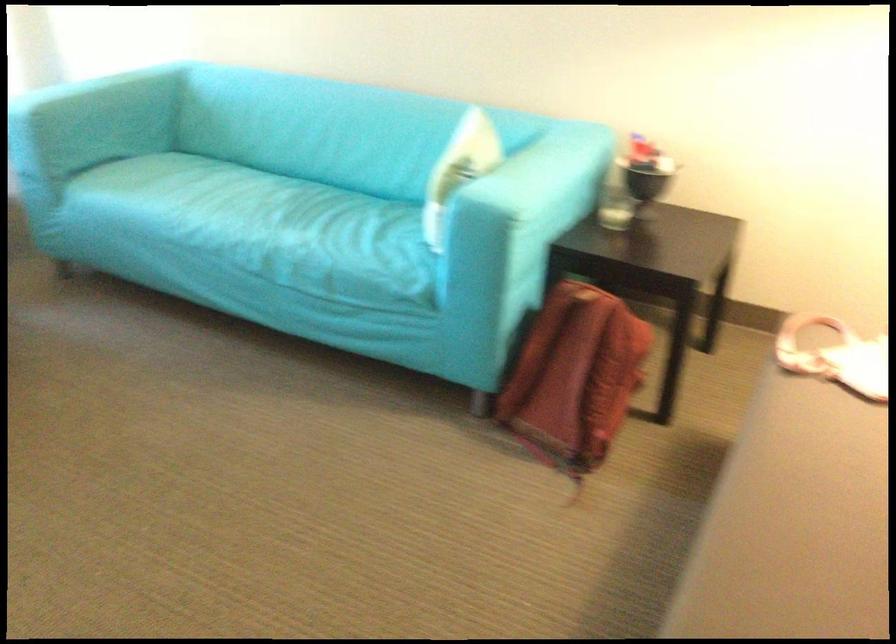
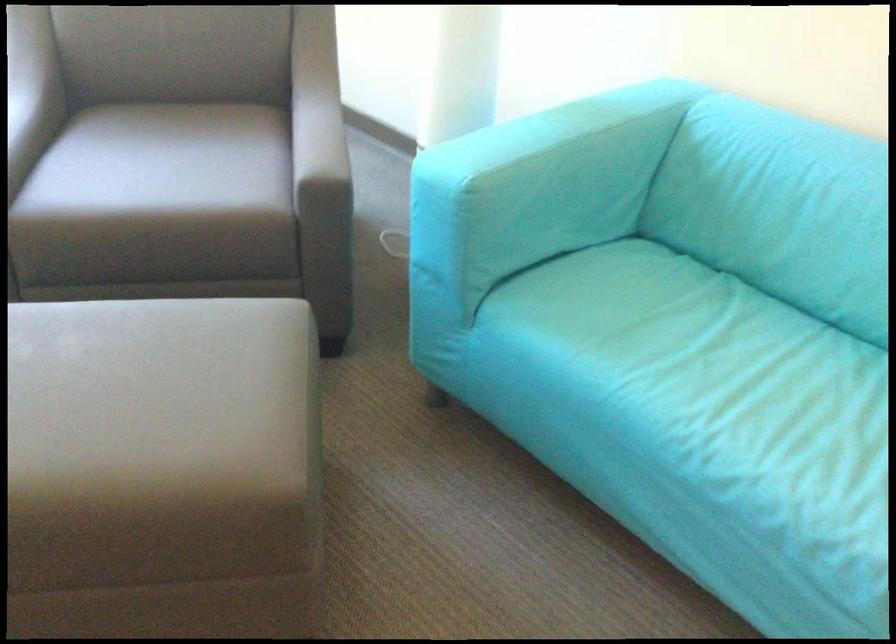
The images are taken continuously from a first-person perspective. In which direction are you moving?

The cameraman moved toward left, forward.